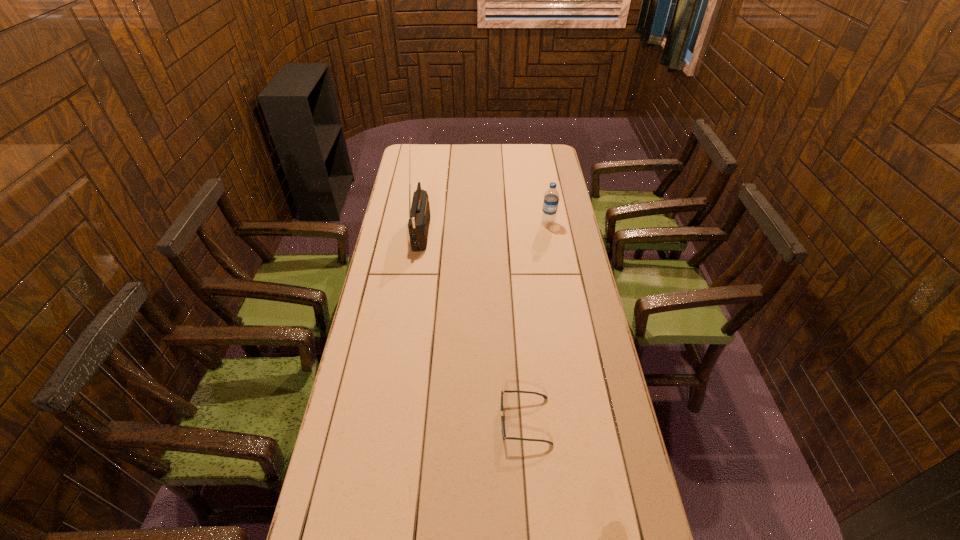
This screenshot has width=960, height=540. Find the location of `empty space between the second object from right to left and the tallest object`. empty space between the second object from right to left and the tallest object is located at coordinates (473, 326).

Image resolution: width=960 pixels, height=540 pixels. I want to click on free space that is in between the radio receiver and the second object from left to right, so click(473, 326).

Locate an element on the screen. object that stands as the closest to the shortest object is located at coordinates (419, 216).

The height and width of the screenshot is (540, 960). Identify the location of object that stands as the second closest to the radio receiver. (506, 391).

You are a GUI agent. You are given a task and a screenshot of the screen. Output one action in this format:
    pyautogui.click(x=<x>, y=<y>)
    Task: Click on the free point that satisfies the following two spatial constraints: 1. on the label of the water bottle; 2. on the face of the nearest object
    
    Given the screenshot: What is the action you would take?
    pyautogui.click(x=583, y=421)

The image size is (960, 540). What are the coordinates of `free spot that satisfies the following two spatial constraints: 1. on the label of the water bottle; 2. on the front-facing side of the radio receiver` in the screenshot? It's located at (549, 230).